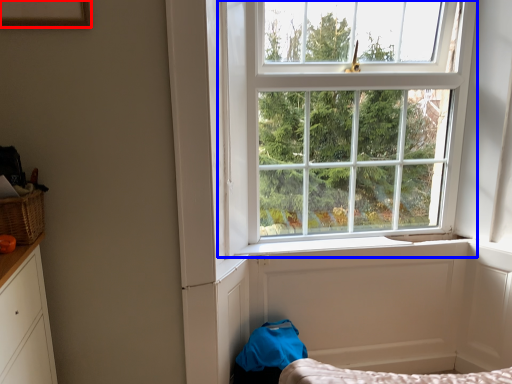
Question: Which object appears farthest to the camera in this image, picture frame (highlighted by a red box) or window (highlighted by a blue box)?

Choices:
 (A) picture frame
 (B) window

Answer: (B)